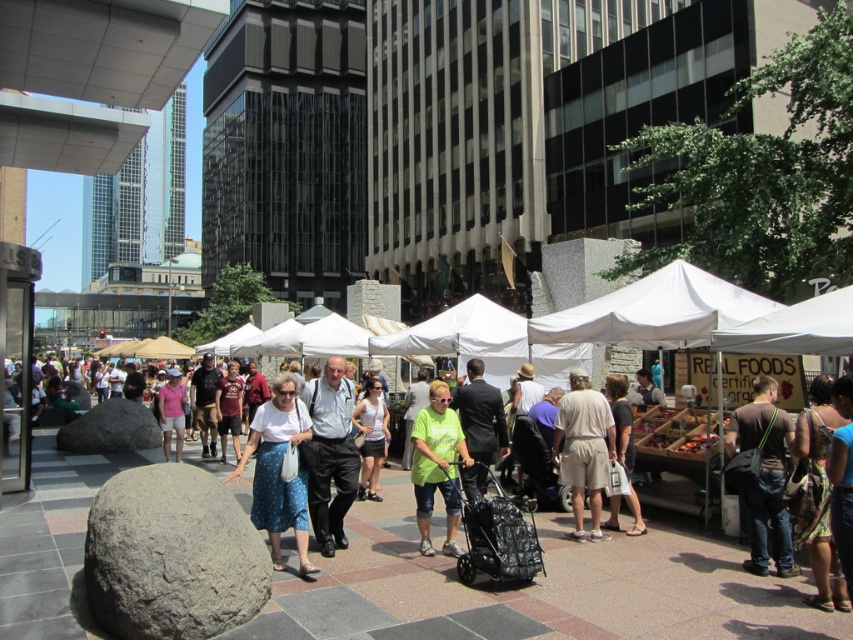
Can you confirm if tan shorts at center is positioned above white cotton tank top at center?

Yes.

Describe the element at coordinates (583, 449) in the screenshot. I see `tan shorts at center` at that location.

Is point (607, 426) closer to viewer compared to point (369, 449)?

Yes.

Locate an element on the screen. Image resolution: width=853 pixels, height=640 pixels. tan shorts at center is located at coordinates (583, 449).

Does dark brown leather backpack at lower right have a smaller size compared to green matte shirt at center?

Indeed, dark brown leather backpack at lower right has a smaller size compared to green matte shirt at center.

Is point (762, 554) positioned after point (448, 544)?

No, (762, 554) is in front of (448, 544).

Where is `dark brown leather backpack at lower right`? This screenshot has width=853, height=640. dark brown leather backpack at lower right is located at coordinates (762, 476).

How far apart are white fabric canopy at center and green matte shirt at center?

white fabric canopy at center and green matte shirt at center are 3.33 meters apart from each other.

Does white fabric canopy at center appear over green matte shirt at center?

Yes.

Based on the photo, who is more forward, (664, 316) or (425, 413)?

Point (425, 413) is in front.

Identify the location of white fabric canopy at center. The width and height of the screenshot is (853, 640). (654, 310).